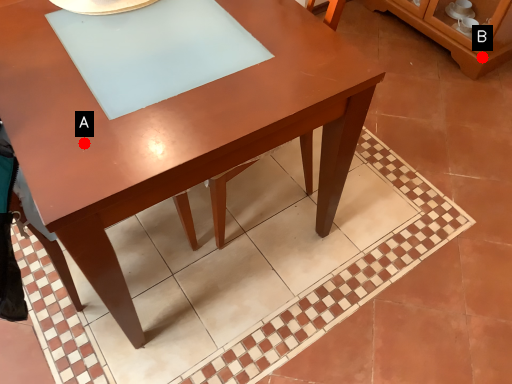
Question: Two points are circled on the image, labeled by A and B beside each circle. Which point is closer to the camera?

Choices:
 (A) A is closer
 (B) B is closer

Answer: (A)